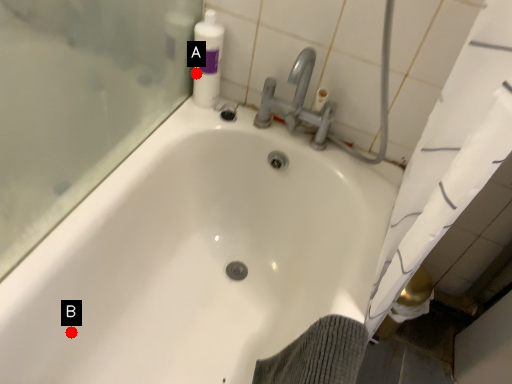
Question: Two points are circled on the image, labeled by A and B beside each circle. Which point is farther to the camera?

Choices:
 (A) A is further
 (B) B is further

Answer: (A)